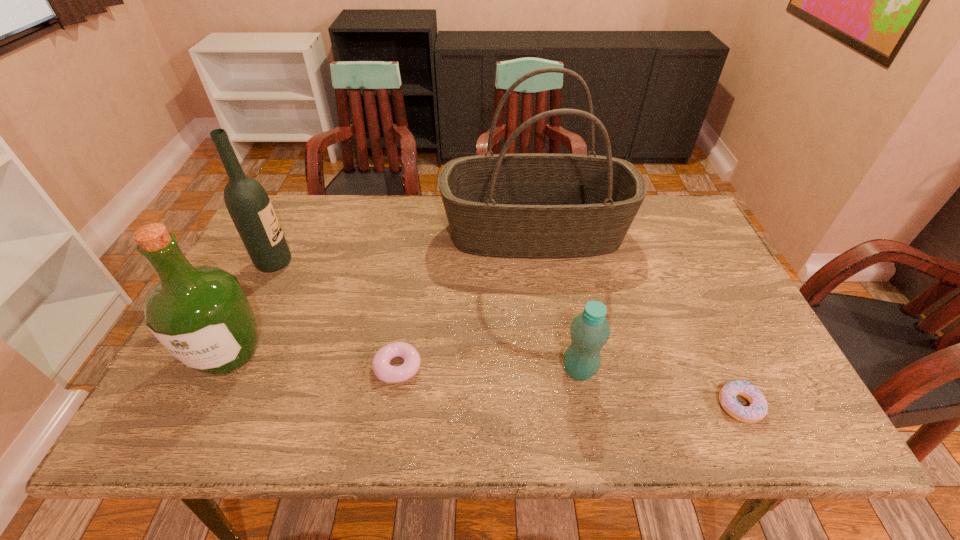
Image resolution: width=960 pixels, height=540 pixels. In order to click on free space located at the front cap of the water bottle in this screenshot , I will do `click(487, 370)`.

The image size is (960, 540). I want to click on vacant area situated 0.200m at the front cap of the water bottle, so click(474, 370).

The height and width of the screenshot is (540, 960). In order to click on vacant space located on the left of the left doughnut in this screenshot , I will do `click(348, 367)`.

Find the location of a particular element. Image resolution: width=960 pixels, height=540 pixels. vacant space located on the back of the rightmost object is located at coordinates (688, 294).

Identify the location of object present at the far edge. (529, 205).

Identify the location of object that is at the near edge. The width and height of the screenshot is (960, 540). (758, 408).

I want to click on wine bottle that is at the left edge, so click(247, 202).

The width and height of the screenshot is (960, 540). I want to click on liquor at the left edge, so click(201, 315).

Locate an element on the screen. Image resolution: width=960 pixels, height=540 pixels. object at the right edge is located at coordinates (758, 408).

Where is `object positioned at the near right corner`? This screenshot has height=540, width=960. object positioned at the near right corner is located at coordinates (758, 408).